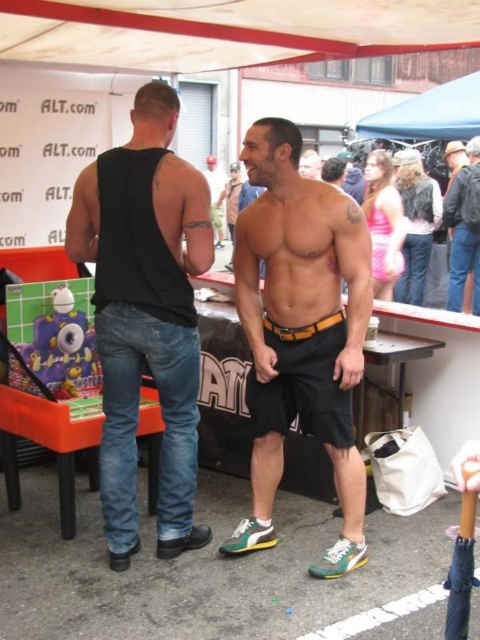
You are at an event and need to decide which item is wider between the black matte shorts at center and the orange leather belt at center. Which one is wider?

The black matte shorts at center is wider than the orange leather belt at center according to the description.

You are standing at the center of the image. There is a point marked at coordinates (145, 314). What object is located at that point?

The point at coordinates (145, 314) marks black denim jeans at left.

You are at an event and need to decide whether your backpack can fit between the black denim jeans at left and the blue fabric canopy at upper center. The backpack is 1 meter wide. Can it fit?

The black denim jeans at left has a lesser width compared to blue fabric canopy at upper center. However, the description only provides a comparison of their widths and does not specify the exact distance between them. Without knowing the actual space between the two objects, it is impossible to determine if the backpack can fit.